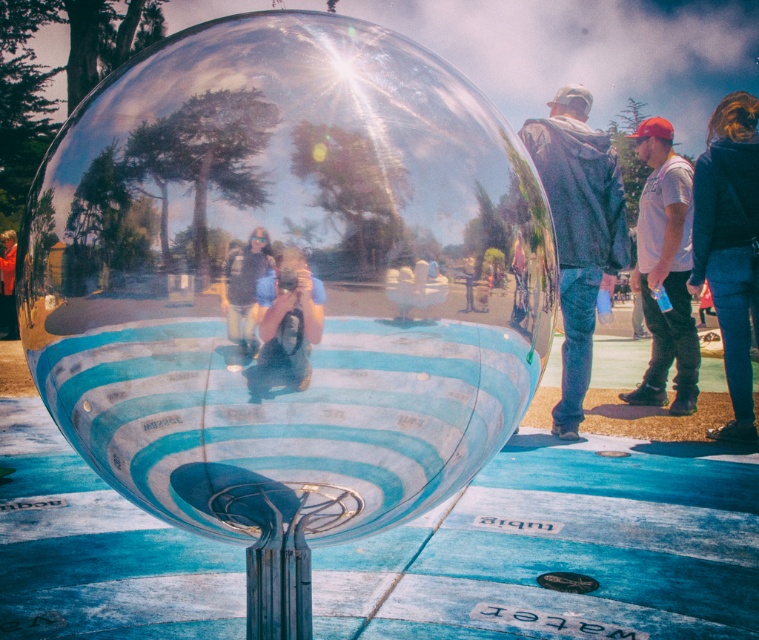
Who is more forward, [609,208] or [14,324]?

Positioned in front is point [609,208].

Is point (561, 188) positioned behind point (5, 326)?

No.

Identify the location of dark gray jacket at right. This screenshot has width=759, height=640. (578, 230).

Based on the photo, does transparent glass bubble at center appear under dark gray jacket at right?

Indeed, transparent glass bubble at center is positioned under dark gray jacket at right.

Which is above, transparent glass bubble at center or dark gray jacket at right?

dark gray jacket at right

Locate an element on the screen. transparent glass bubble at center is located at coordinates (274, 273).

Find the location of `transparent glass bubble at center`. transparent glass bubble at center is located at coordinates (274, 273).

Is white cotton shirt at right taller than blue fabric camera at center?

Correct, white cotton shirt at right is much taller as blue fabric camera at center.

Between white cotton shirt at right and blue fabric camera at center, which one is positioned higher?

white cotton shirt at right

Does point (644, 392) come behind point (249, 384)?

That is True.

Find the location of a particular element. The image size is (759, 640). white cotton shirt at right is located at coordinates (665, 268).